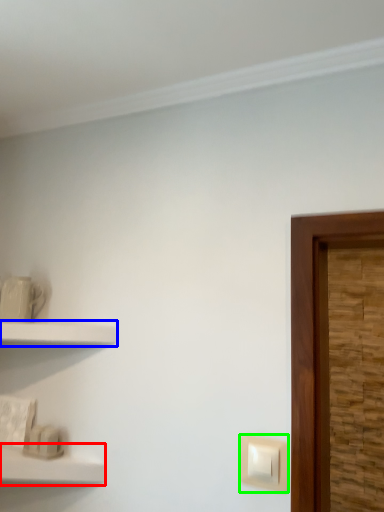
Question: Which object is positioned closest to shelf (highlighted by a red box)? Select from shelf (highlighted by a blue box) and light switch (highlighted by a green box).

Choices:
 (A) shelf
 (B) light switch

Answer: (A)